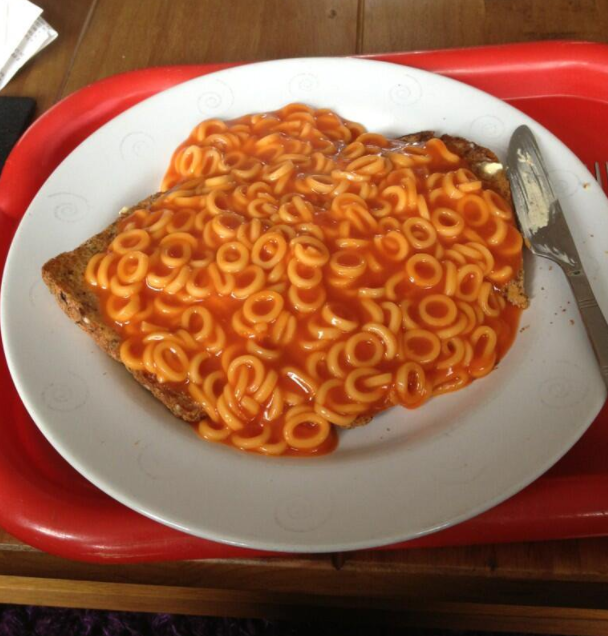
This screenshot has width=608, height=636. I want to click on table edge, so coord(198,605).